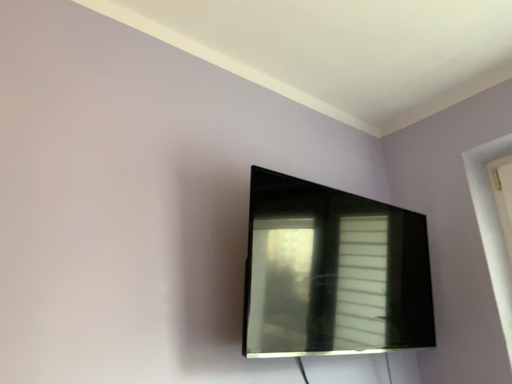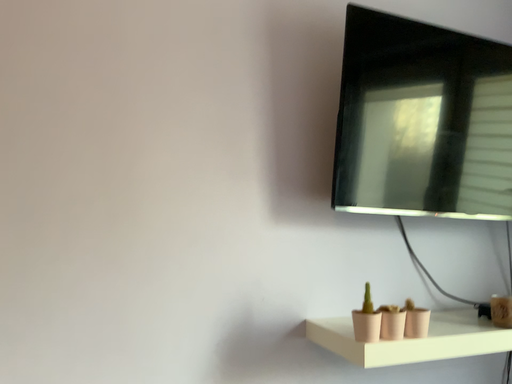
Question: Which way did the camera rotate in the video?

Choices:
 (A) rotated left
 (B) rotated right

Answer: (A)